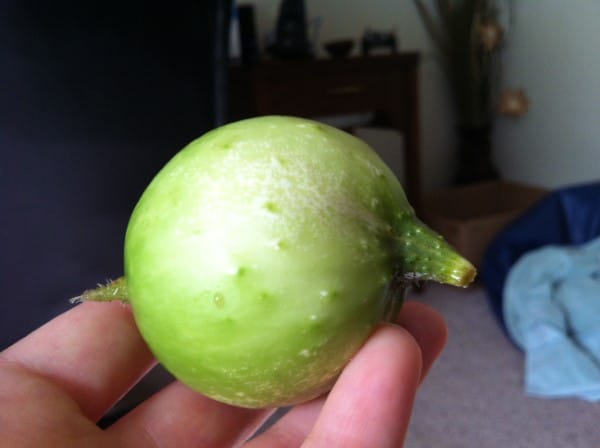
The height and width of the screenshot is (448, 600). I want to click on cloth, so click(x=553, y=300).